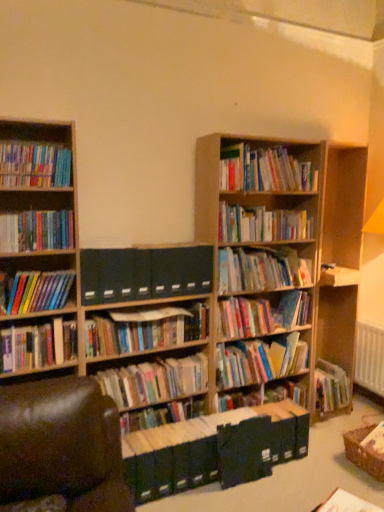
Question: From the image's perspective, does hardcover books at center, acting as the 5th book starting from the bottom, appear higher than dark blue file folders at center, the 11th book in the bottom-to-top sequence?

Choices:
 (A) yes
 (B) no

Answer: (B)

Question: Does hardcover books at center, acting as the 5th book starting from the bottom, have a greater width compared to dark blue file folders at center, the 11th book in the bottom-to-top sequence?

Choices:
 (A) no
 (B) yes

Answer: (B)

Question: Is hardcover books at center, which appears as the twelfth book when viewed from the top, surrounding dark blue file folders at center, the 11th book in the bottom-to-top sequence?

Choices:
 (A) yes
 (B) no

Answer: (B)

Question: From the image's perspective, does hardcover books at center, acting as the 5th book starting from the bottom, appear lower than dark blue file folders at center, the 11th book in the bottom-to-top sequence?

Choices:
 (A) no
 (B) yes

Answer: (B)

Question: Does hardcover books at center, which appears as the twelfth book when viewed from the top, appear on the right side of dark blue file folders at center, the 11th book in the bottom-to-top sequence?

Choices:
 (A) yes
 (B) no

Answer: (A)

Question: Is hardcover books at center, which appears as the twelfth book when viewed from the top, aimed at dark blue file folders at center, the 11th book in the bottom-to-top sequence?

Choices:
 (A) yes
 (B) no

Answer: (B)

Question: Can you confirm if multicolored paperbacks at center, the fifth book in the top-to-bottom sequence, is thinner than hardcover books at center, the 10th book viewed from the top?

Choices:
 (A) no
 (B) yes

Answer: (A)

Question: Considering the relative sizes of multicolored paperbacks at center, the 12th book ordered from the bottom, and hardcover books at center, which is the 7th book in bottom-to-top order, in the image provided, is multicolored paperbacks at center, the 12th book ordered from the bottom, taller than hardcover books at center, which is the 7th book in bottom-to-top order,?

Choices:
 (A) no
 (B) yes

Answer: (B)

Question: Is multicolored paperbacks at center, the 12th book ordered from the bottom, at the left side of hardcover books at center, the 10th book viewed from the top?

Choices:
 (A) no
 (B) yes

Answer: (A)

Question: Is the position of multicolored paperbacks at center, the 12th book ordered from the bottom, more distant than that of hardcover books at center, the 10th book viewed from the top?

Choices:
 (A) no
 (B) yes

Answer: (B)

Question: Could you tell me if multicolored paperbacks at center, the fifth book in the top-to-bottom sequence, is facing hardcover books at center, the 10th book viewed from the top?

Choices:
 (A) yes
 (B) no

Answer: (B)

Question: Is multicolored paperbacks at center, the fifth book in the top-to-bottom sequence, smaller than hardcover books at center, the 10th book viewed from the top?

Choices:
 (A) yes
 (B) no

Answer: (B)

Question: Is hardcover books at center, the ninth book in the top-to-bottom sequence, not inside brown leather swivel chair at lower left?

Choices:
 (A) no
 (B) yes

Answer: (B)